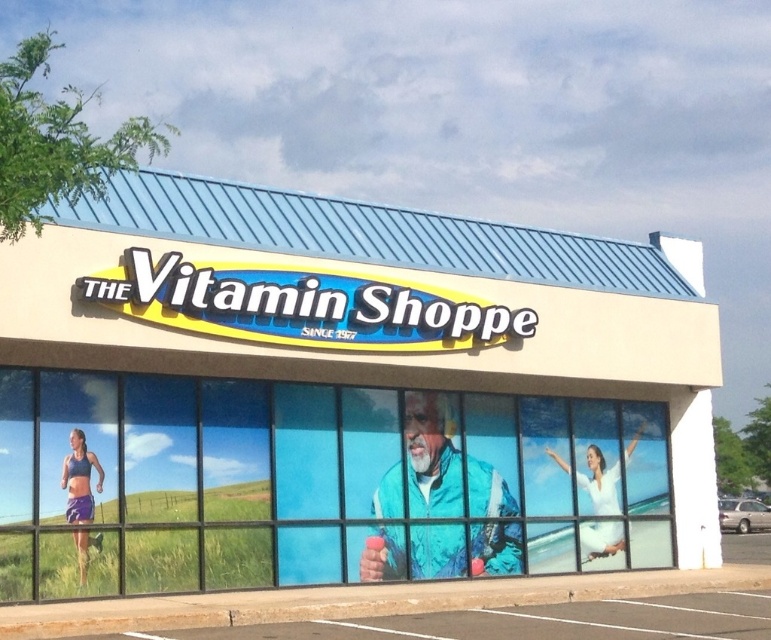
Is white sign at center below silver metallic car at lower right?

No.

Between point (604, 493) and point (739, 541), which one is positioned behind?

Positioned behind is point (739, 541).

Locate an element on the screen. white sign at center is located at coordinates (349, 390).